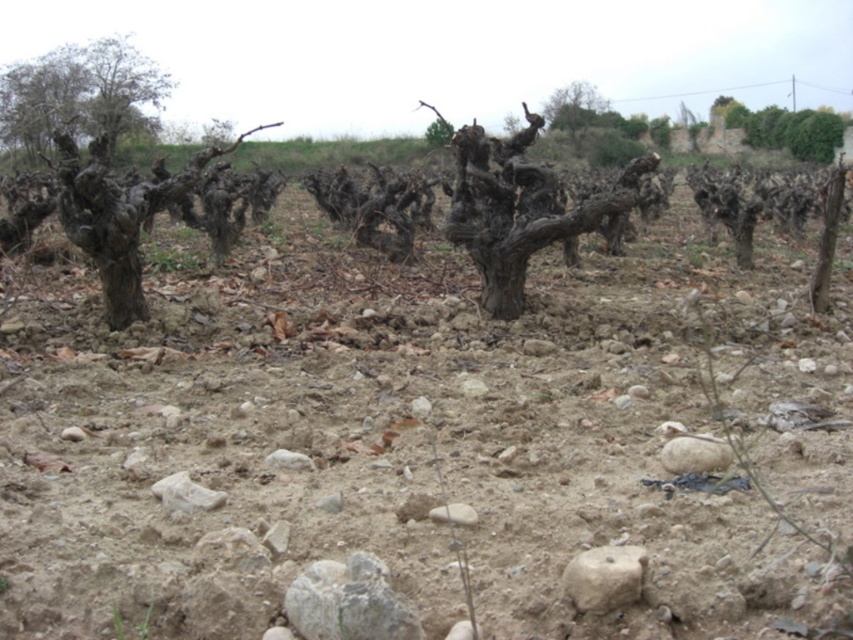
From the picture: You are a gardener planning to plant a new tree in the vineyard. You have a small sapling that requires at least 2 meters of space above it to grow. Based on the scene, can the green leafy bush at upper right and the dark brown bark tree at left provide enough vertical space for the sapling?

The dark brown bark tree at left is much taller than the green leafy bush at upper right. Since the sapling needs at least 2 meters of vertical space, the dark brown bark tree at left may block the required height, but the green leafy bush at upper right is shorter, so planting near it might allow enough space. However, the exact height of both objects isn

You are a hiker standing at the edge of the vineyard and see the dark brown bark tree at left and the gray rough bark tree at center. Which tree would appear larger in your view?

The dark brown bark tree at left is closer to the viewer than the gray rough bark tree at center, so it would appear larger in your view.